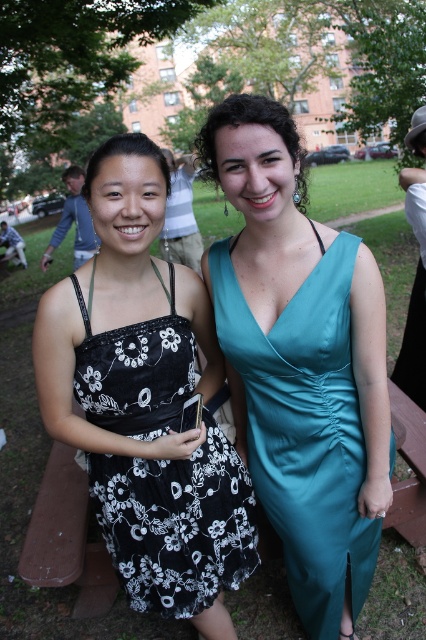
What do you see at coordinates (305, 429) in the screenshot? I see `teal satin dress at center` at bounding box center [305, 429].

Which is behind, point (255, 355) or point (166, 292)?

The point (166, 292) is behind.

This screenshot has width=426, height=640. What are the coordinates of `teal satin dress at center` in the screenshot? It's located at (305, 429).